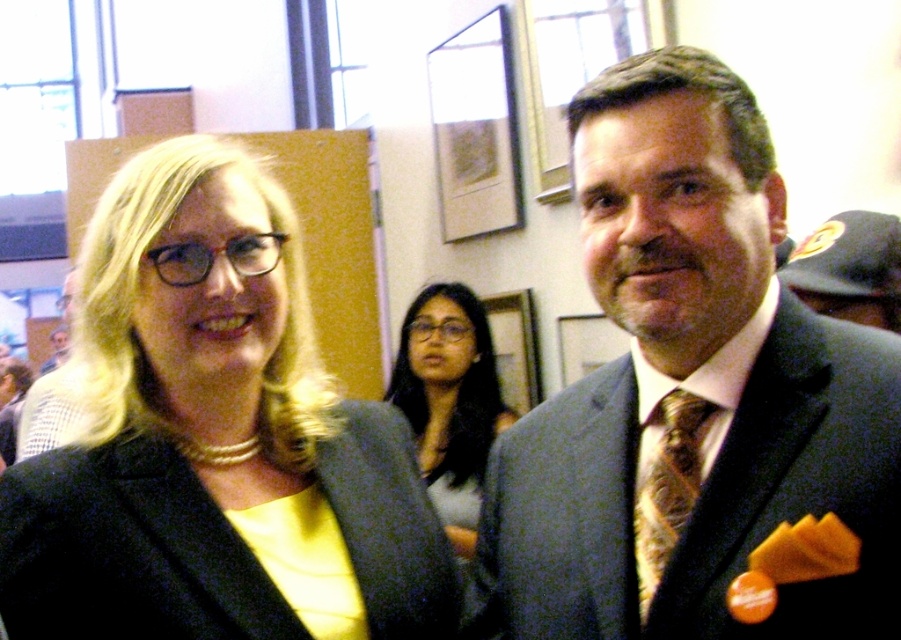
You are a photographer at a formal event and need to adjust the camera focus. You see two subjects wearing the matte gray suit at center and the matte black suit at center. Which suit is closer to the camera?

The matte gray suit at center is in front of the matte black suit at center, so it is closer to the camera.